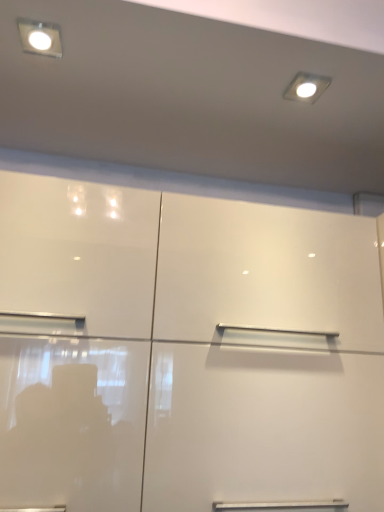
Question: From the image's perspective, is matte white light fixture at upper right beneath glossy white cupboard at center?

Choices:
 (A) yes
 (B) no

Answer: (B)

Question: Is matte white light fixture at upper right shorter than glossy white cupboard at center?

Choices:
 (A) no
 (B) yes

Answer: (B)

Question: Is matte white light fixture at upper right located outside glossy white cupboard at center?

Choices:
 (A) yes
 (B) no

Answer: (A)

Question: From the image's perspective, is matte white light fixture at upper right on glossy white cupboard at center?

Choices:
 (A) no
 (B) yes

Answer: (B)

Question: Is matte white light fixture at upper right positioned with its back to glossy white cupboard at center?

Choices:
 (A) yes
 (B) no

Answer: (B)

Question: Considering the relative positions of matte white light fixture at upper right and glossy white cupboard at center in the image provided, is matte white light fixture at upper right to the right of glossy white cupboard at center from the viewer's perspective?

Choices:
 (A) yes
 (B) no

Answer: (A)

Question: Can you confirm if glossy white cupboard at center is thinner than matte white light fixture at upper right?

Choices:
 (A) no
 (B) yes

Answer: (A)

Question: From a real-world perspective, is glossy white cupboard at center on matte white light fixture at upper right?

Choices:
 (A) yes
 (B) no

Answer: (B)

Question: Is glossy white cupboard at center at the right side of matte white light fixture at upper right?

Choices:
 (A) yes
 (B) no

Answer: (B)

Question: Considering the relative positions of glossy white cupboard at center and matte white light fixture at upper right in the image provided, is glossy white cupboard at center to the left of matte white light fixture at upper right from the viewer's perspective?

Choices:
 (A) yes
 (B) no

Answer: (A)

Question: From a real-world perspective, does glossy white cupboard at center sit lower than matte white light fixture at upper right?

Choices:
 (A) no
 (B) yes

Answer: (B)

Question: Is glossy white cupboard at center smaller than matte white light fixture at upper right?

Choices:
 (A) no
 (B) yes

Answer: (A)

Question: From the image's perspective, does matte white square at upper left appear higher than matte white light fixture at upper right?

Choices:
 (A) yes
 (B) no

Answer: (A)